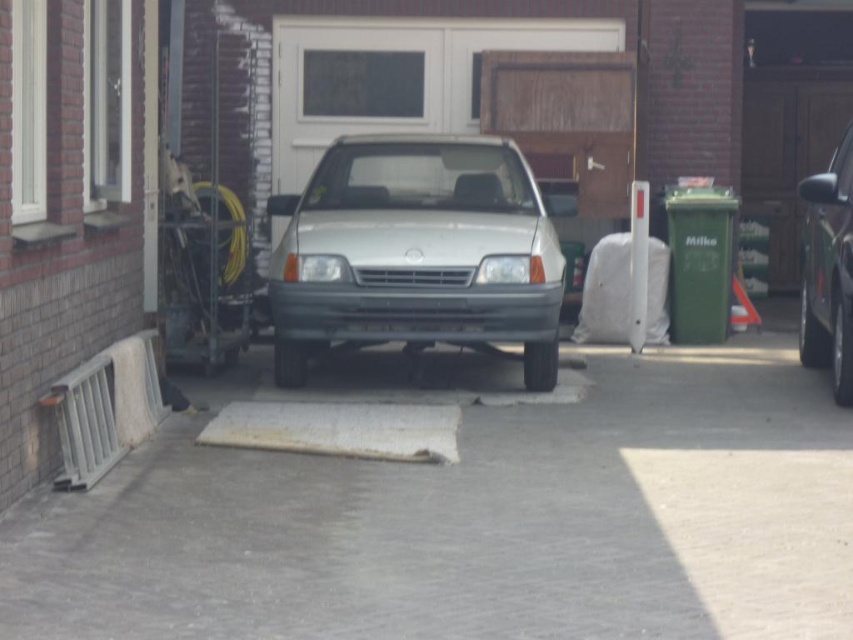
Question: Which object appears closest to the camera in this image?

Choices:
 (A) shiny metallic suv at right
 (B) gray concrete driveway at center
 (C) satin silver car at center

Answer: (B)

Question: Which point is farther to the camera?

Choices:
 (A) (849, 266)
 (B) (505, 417)
 (C) (509, 260)

Answer: (C)

Question: Does gray concrete driveway at center have a lesser width compared to satin silver car at center?

Choices:
 (A) yes
 (B) no

Answer: (A)

Question: Among these objects, which one is farthest from the camera?

Choices:
 (A) shiny metallic suv at right
 (B) satin silver car at center
 (C) gray concrete driveway at center

Answer: (B)

Question: Observing the image, what is the correct spatial positioning of gray concrete driveway at center in reference to satin silver car at center?

Choices:
 (A) above
 (B) below

Answer: (B)

Question: Can you confirm if satin silver car at center is smaller than shiny metallic suv at right?

Choices:
 (A) no
 (B) yes

Answer: (A)